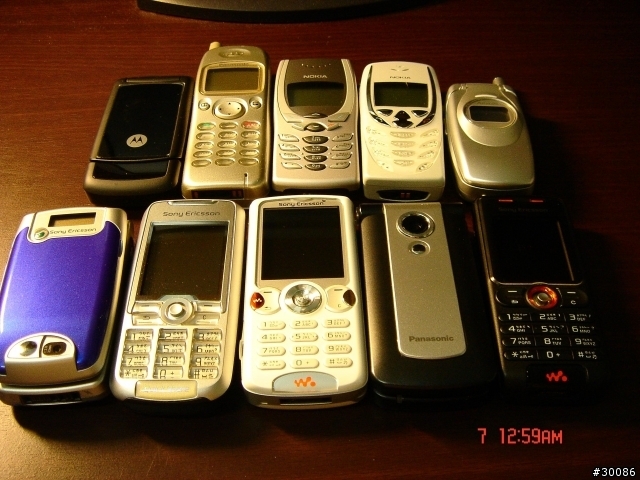
You are a GUI agent. You are given a task and a screenshot of the screen. Output one action in this format:
    pyautogui.click(x=<x>, y=<y>)
    Task: Click on the phones
    The image size is (640, 480).
    Given the screenshot: What is the action you would take?
    pyautogui.click(x=141, y=143), pyautogui.click(x=219, y=130), pyautogui.click(x=203, y=318), pyautogui.click(x=88, y=308), pyautogui.click(x=297, y=296), pyautogui.click(x=317, y=154), pyautogui.click(x=426, y=271), pyautogui.click(x=403, y=131), pyautogui.click(x=498, y=153), pyautogui.click(x=534, y=272)